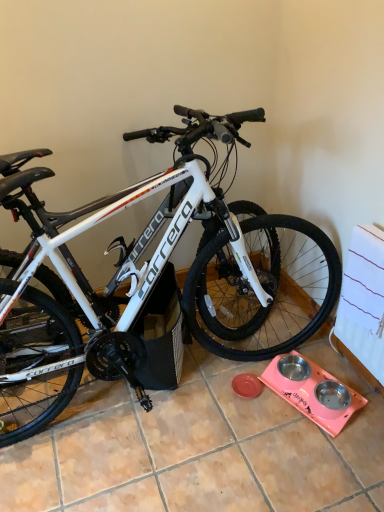
Identify the location of free space on the front side of white matte bicycle at center. (186, 454).